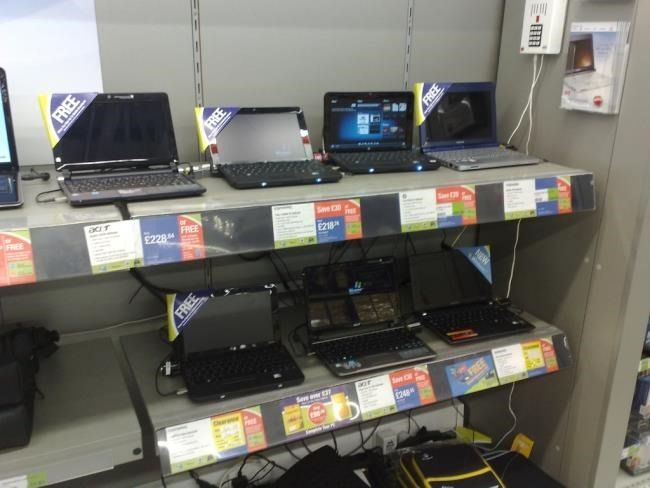
What are the coordinates of `white computer/ electrical cable` in the screenshot? It's located at (513, 411).